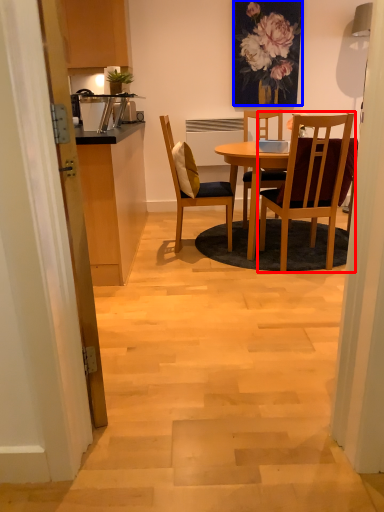
Question: Which object is closer to the camera taking this photo, chair (highlighted by a red box) or floral arrangement (highlighted by a blue box)?

Choices:
 (A) chair
 (B) floral arrangement

Answer: (A)